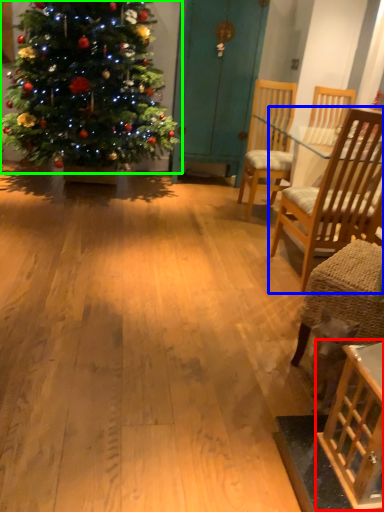
Question: Estimate the real-world distances between objects in this image. Which object is closer to table (highlighted by a red box), chair (highlighted by a blue box) or christmas tree (highlighted by a green box)?

Choices:
 (A) chair
 (B) christmas tree

Answer: (A)